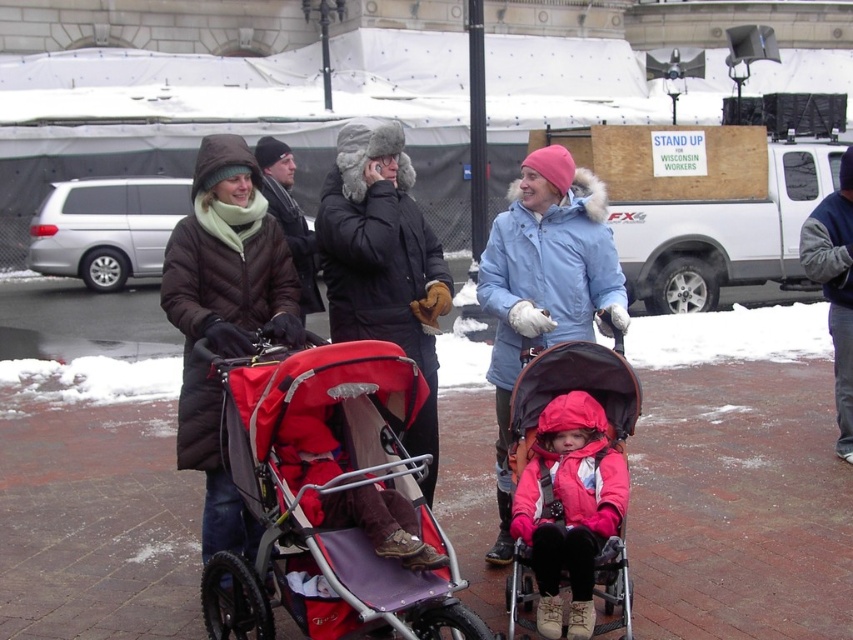
Question: Which point appears farthest from the camera in this image?

Choices:
 (A) (386, 500)
 (B) (775, 362)
 (C) (241, 547)
 (D) (549, 609)

Answer: (B)

Question: Considering the real-world distances, which object is closest to the velvet red coat at center?

Choices:
 (A) brown quilted coat at center
 (B) matte pink jacket at center
 (C) matte black coat at center
 (D) red fabric stroller at center

Answer: (D)

Question: Does brick pavement at center have a greater width compared to matte red stroller at center?

Choices:
 (A) no
 (B) yes

Answer: (A)

Question: Which point is farther to the camera?

Choices:
 (A) (741, 390)
 (B) (560, 566)
 (C) (379, 522)
 (D) (207, 237)

Answer: (A)

Question: Is matte black coat at center below matte pink jacket at center?

Choices:
 (A) no
 (B) yes

Answer: (A)

Question: Can you confirm if red fabric stroller at center is positioned to the left of brown quilted coat at center?

Choices:
 (A) yes
 (B) no

Answer: (B)